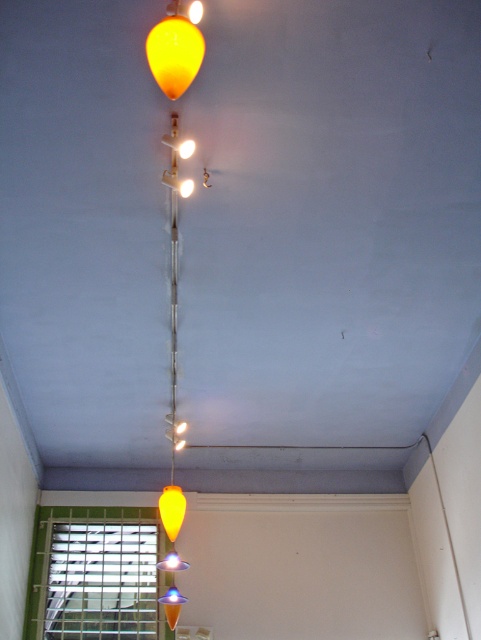
You are an interior designer assessing the lighting in a room. You notice the translucent yellow balloon at upper center and the matte yellow cone at center. Which object would cast a wider shadow given their sizes?

The translucent yellow balloon at upper center has a larger size compared to the matte yellow cone at center, so it would cast a wider shadow.